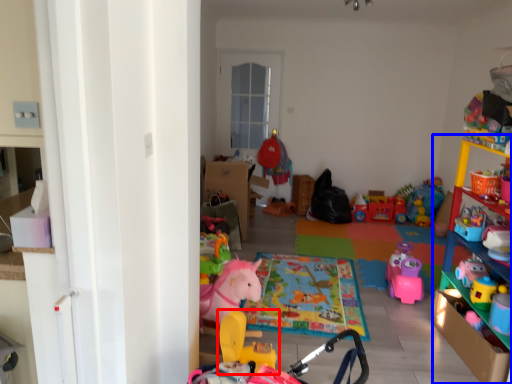
Question: Which object appears farthest to the camera in this image, toy (highlighted by a red box) or shelf (highlighted by a blue box)?

Choices:
 (A) toy
 (B) shelf

Answer: (A)